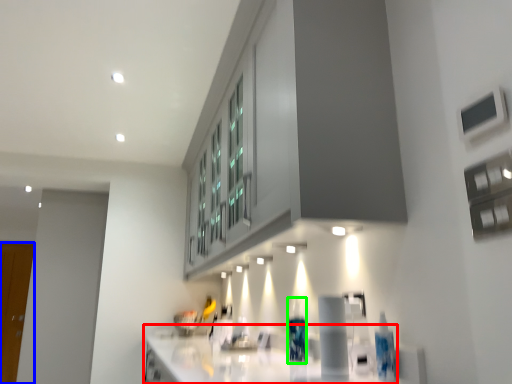
Question: Estimate the real-world distances between objects in this image. Which object is closer to countertop (highlighted by a red box), glass door (highlighted by a blue box) or bottle (highlighted by a green box)?

Choices:
 (A) glass door
 (B) bottle

Answer: (B)